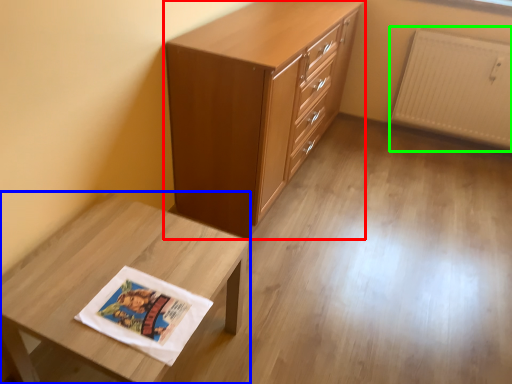
Question: Considering the real-world distances, which object is closest to chest of drawers (highlighted by a red box)? table (highlighted by a blue box) or radiator (highlighted by a green box).

Choices:
 (A) table
 (B) radiator

Answer: (A)